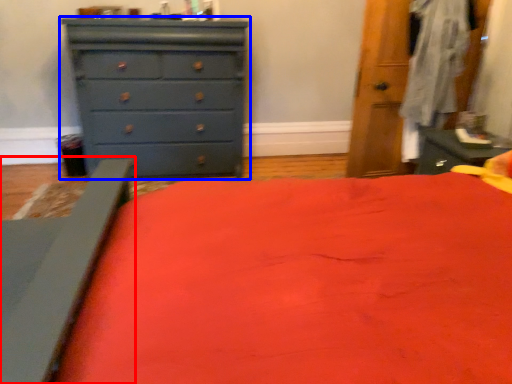
Question: Which point is closer to the camera, bed frame (highlighted by a red box) or chest of drawers (highlighted by a blue box)?

Choices:
 (A) bed frame
 (B) chest of drawers

Answer: (A)